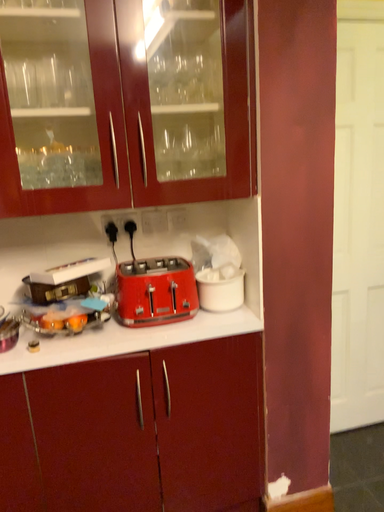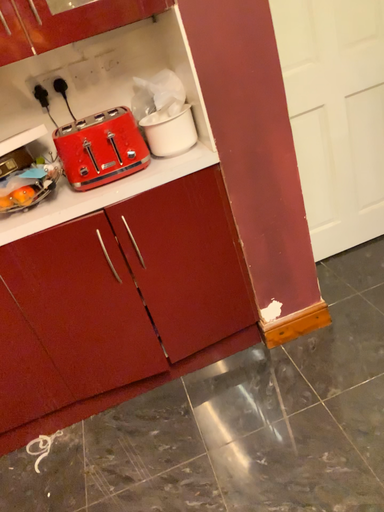
Question: Which way did the camera rotate in the video?

Choices:
 (A) rotated upward
 (B) rotated downward

Answer: (B)